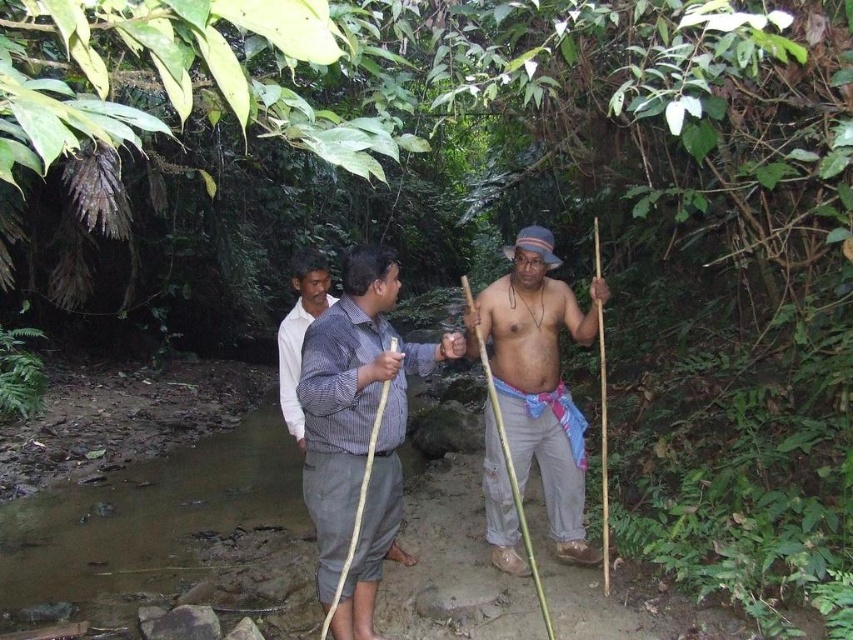
Question: Among these points, which one is farthest from the camera?

Choices:
 (A) (370, 628)
 (B) (549, 433)

Answer: (B)

Question: Which of the following is the farthest from the observer?

Choices:
 (A) (502, 356)
 (B) (386, 538)

Answer: (A)

Question: Can you confirm if checkered fabric shirt at center is wider than matte brown stick at center?

Choices:
 (A) yes
 (B) no

Answer: (B)

Question: Is checkered fabric shirt at center thinner than matte brown stick at center?

Choices:
 (A) yes
 (B) no

Answer: (A)

Question: Does checkered fabric shirt at center appear under matte brown stick at center?

Choices:
 (A) no
 (B) yes

Answer: (B)

Question: Which point is farther to the camera?

Choices:
 (A) (366, 417)
 (B) (515, 358)

Answer: (B)